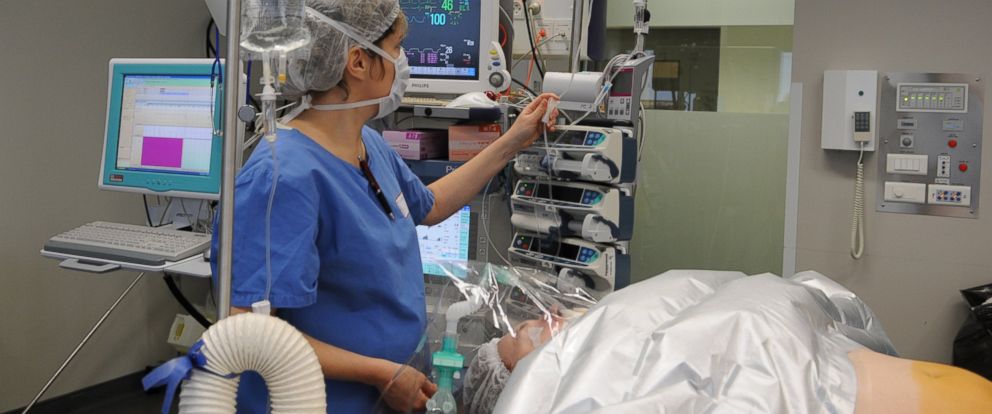
You are a GUI agent. You are given a task and a screenshot of the screen. Output one action in this format:
    pyautogui.click(x=<x>, y=<y>)
    Task: Click on the mouse tray
    
    Given the screenshot: What is the action you would take?
    pyautogui.click(x=187, y=271)